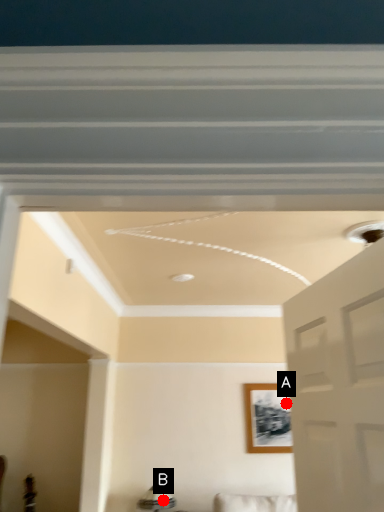
Question: Two points are circled on the image, labeled by A and B beside each circle. Which point appears closest to the camera in this image?

Choices:
 (A) A is closer
 (B) B is closer

Answer: (B)